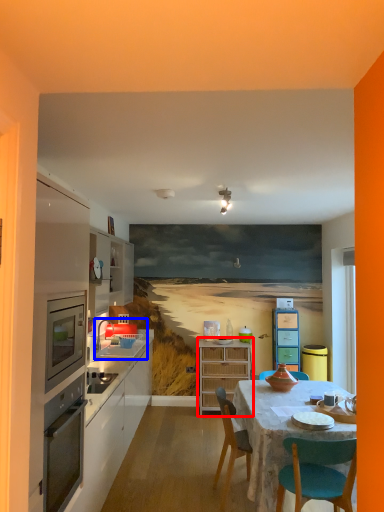
Question: Which point is further to the camera, cabinetry (highlighted by a red box) or sink (highlighted by a blue box)?

Choices:
 (A) cabinetry
 (B) sink

Answer: (A)